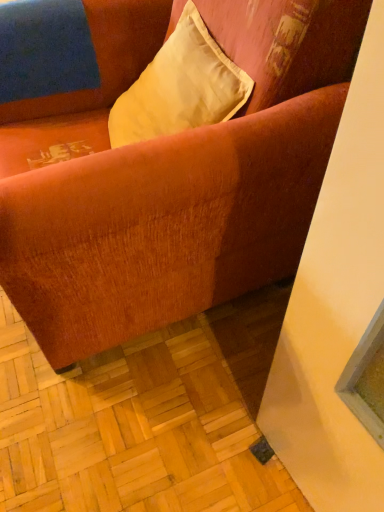
Question: Considering the positions of velvet orange couch at center and satin yellow pillow at upper center in the image, is velvet orange couch at center wider or thinner than satin yellow pillow at upper center?

Choices:
 (A) thin
 (B) wide

Answer: (B)

Question: In terms of size, does velvet orange couch at center appear bigger or smaller than satin yellow pillow at upper center?

Choices:
 (A) small
 (B) big

Answer: (B)

Question: Considering the positions of velvet orange couch at center and satin yellow pillow at upper center in the image, is velvet orange couch at center taller or shorter than satin yellow pillow at upper center?

Choices:
 (A) short
 (B) tall

Answer: (B)

Question: Is satin yellow pillow at upper center spatially inside velvet orange couch at center, or outside of it?

Choices:
 (A) inside
 (B) outside

Answer: (A)

Question: From a real-world perspective, is satin yellow pillow at upper center above or below velvet orange couch at center?

Choices:
 (A) above
 (B) below

Answer: (A)

Question: Is point (185, 73) closer or farther from the camera than point (221, 190)?

Choices:
 (A) closer
 (B) farther

Answer: (B)

Question: In terms of height, does satin yellow pillow at upper center look taller or shorter compared to velvet orange couch at center?

Choices:
 (A) short
 (B) tall

Answer: (A)